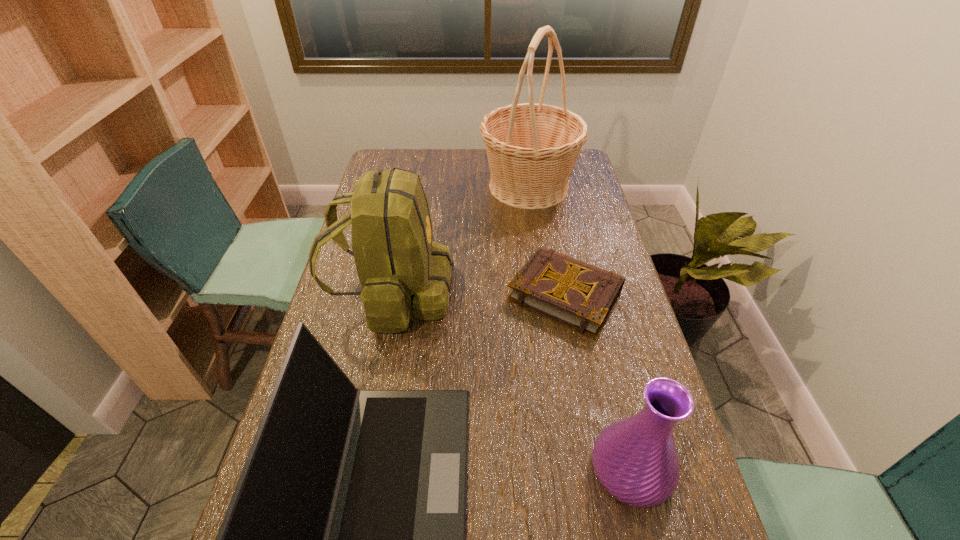
What are the coordinates of `object that is at the left edge` in the screenshot? It's located at (403, 273).

Locate an element on the screen. basket at the right edge is located at coordinates (532, 148).

Locate an element on the screen. Image resolution: width=960 pixels, height=540 pixels. vase at the right edge is located at coordinates (635, 459).

This screenshot has height=540, width=960. Identify the location of hardback book located at the right edge. tap(577, 294).

The image size is (960, 540). Find the location of `object at the far right corner`. object at the far right corner is located at coordinates (532, 148).

This screenshot has height=540, width=960. I want to click on free space at the far edge, so click(x=417, y=160).

Locate an element on the screen. This screenshot has height=540, width=960. blank area at the left edge is located at coordinates (347, 320).

Identify the location of vacant space at the right edge of the desktop. The height and width of the screenshot is (540, 960). (629, 329).

Locate an element on the screen. This screenshot has width=960, height=540. free point between the basket and the shortest object is located at coordinates (547, 240).

At what (x,y) coordinates should I click in order to perform the action: click on free space between the hardback book and the second tallest object. Please return your answer as a coordinate pair (x, y). This screenshot has width=960, height=540. Looking at the image, I should click on (479, 294).